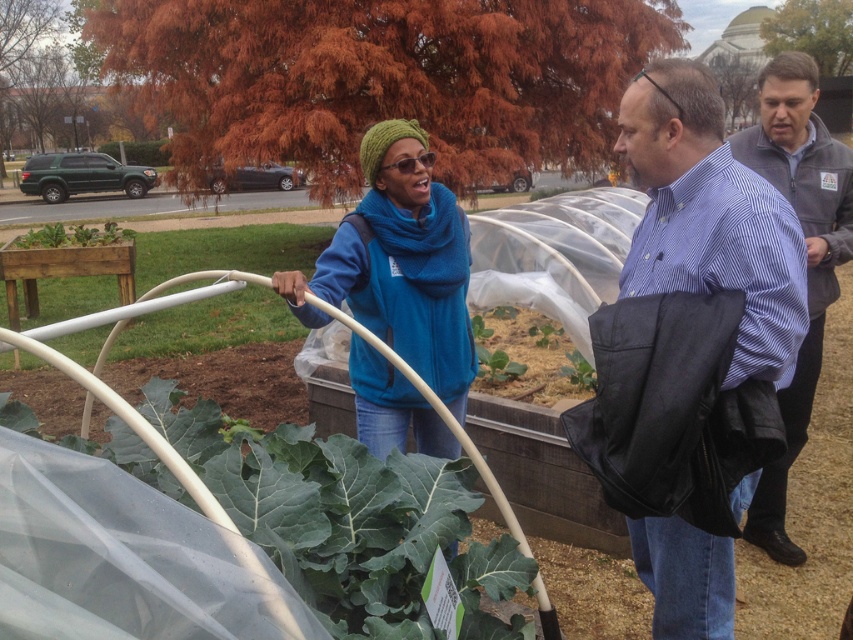
Does blue fleece jacket at center have a smaller size compared to green leafy at center?

Actually, blue fleece jacket at center might be larger than green leafy at center.

Is blue fleece jacket at center bigger than green leafy at center?

Indeed, blue fleece jacket at center has a larger size compared to green leafy at center.

Measure the distance between blue fleece jacket at center and camera.

A distance of 7.07 feet exists between blue fleece jacket at center and camera.

Where is `blue fleece jacket at center`? This screenshot has width=853, height=640. blue fleece jacket at center is located at coordinates (399, 262).

Can you confirm if green leafy vegetable at center is positioned above gray fleece jacket at center?

No, green leafy vegetable at center is not above gray fleece jacket at center.

The height and width of the screenshot is (640, 853). In order to click on green leafy vegetable at center in this screenshot , I will do `click(328, 512)`.

Who is positioned more to the left, green leafy vegetable at center or matte blue shirt at center?

green leafy vegetable at center is more to the left.

Which is below, green leafy vegetable at center or matte blue shirt at center?

green leafy vegetable at center is lower down.

Is point (349, 566) positioned before point (701, 115)?

That is True.

This screenshot has height=640, width=853. I want to click on green leafy vegetable at center, so click(x=328, y=512).